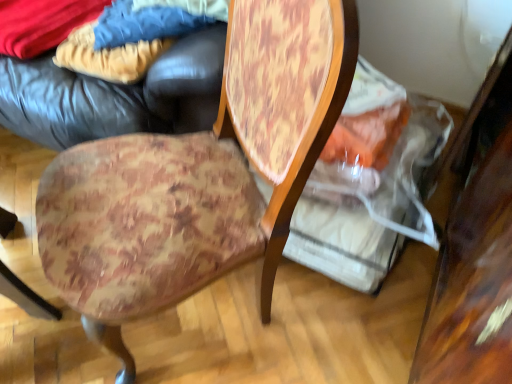
Question: In terms of size, does velvet-like beige pants at upper left, the 2th fabric when ordered from right to left, appear bigger or smaller than wooden table at right?

Choices:
 (A) big
 (B) small

Answer: (B)

Question: Considering the positions of velvet-like beige pants at upper left, the 2th fabric when ordered from right to left, and wooden table at right in the image, is velvet-like beige pants at upper left, the 2th fabric when ordered from right to left, taller or shorter than wooden table at right?

Choices:
 (A) tall
 (B) short

Answer: (B)

Question: Considering the real-world distances, which object is closest to the blue denim jeans at upper left, the first fabric positioned from the right?

Choices:
 (A) leather bean bag at upper left
 (B) velvety blue blanket at upper left, the first fabric from the left
 (C) wooden table at right
 (D) floral fabric cushion at center
 (E) velvet-like beige pants at upper left, the second fabric viewed from the left

Answer: (E)

Question: Based on their relative distances, which object is farther from the velvet-like beige pants at upper left, the second fabric viewed from the left?

Choices:
 (A) floral fabric cushion at center
 (B) blue denim jeans at upper left, the first fabric positioned from the right
 (C) wooden table at right
 (D) velvety blue blanket at upper left, which appears as the third fabric when viewed from the right
 (E) leather bean bag at upper left

Answer: (C)